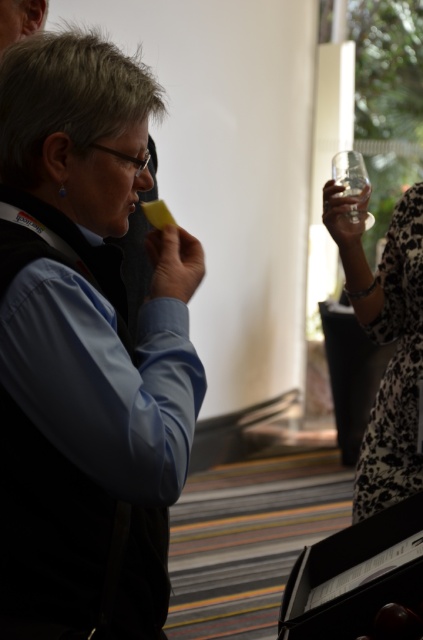
Is matte black vest at center further to camera compared to clear plastic cup at upper right?

No, it is in front of clear plastic cup at upper right.

Measure the distance between matte black vest at center and camera.

94.56 centimeters

Find the location of a particular element. matte black vest at center is located at coordinates (85, 349).

Is transparent glass at upper right shorter than clear plastic cup at upper right?

In fact, transparent glass at upper right may be taller than clear plastic cup at upper right.

Between transparent glass at upper right and clear plastic cup at upper right, which one appears on the left side from the viewer's perspective?

From the viewer's perspective, transparent glass at upper right appears more on the left side.

The height and width of the screenshot is (640, 423). I want to click on transparent glass at upper right, so click(353, 189).

The width and height of the screenshot is (423, 640). Find the location of `transparent glass at upper right`. transparent glass at upper right is located at coordinates (353, 189).

Does point (107, 259) lie in front of point (353, 198)?

That is True.

Find the location of a particular element. Image resolution: width=423 pixels, height=640 pixels. matte black vest at center is located at coordinates (85, 349).

Where is `matte black vest at center`? Image resolution: width=423 pixels, height=640 pixels. matte black vest at center is located at coordinates (85, 349).